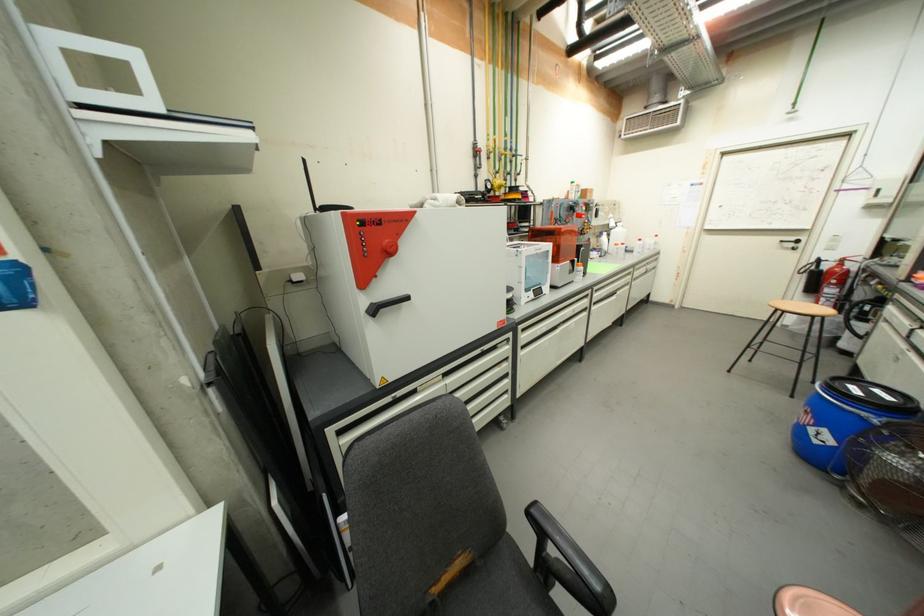
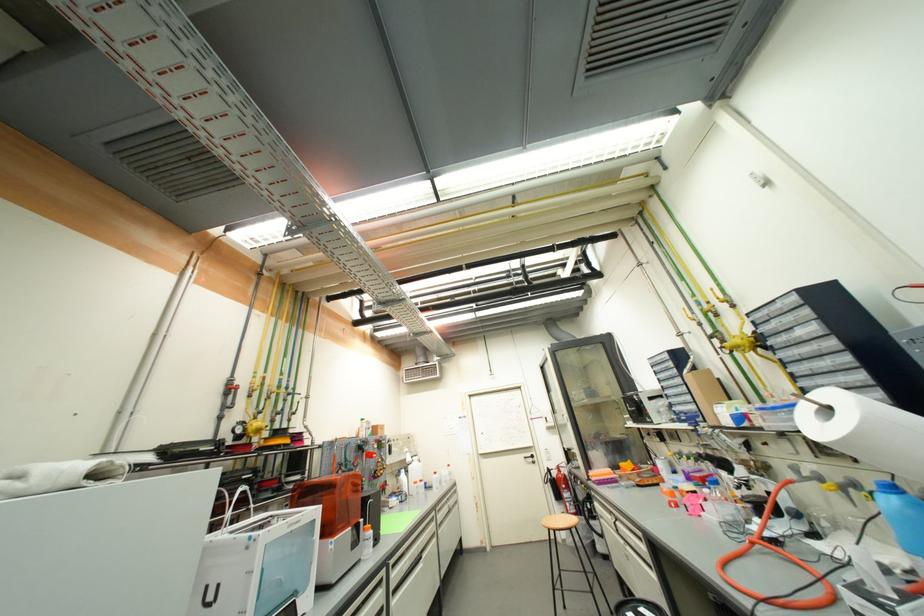
Locate, in the second image, the point that corresponds to point (638, 280) in the first image.

(444, 525)